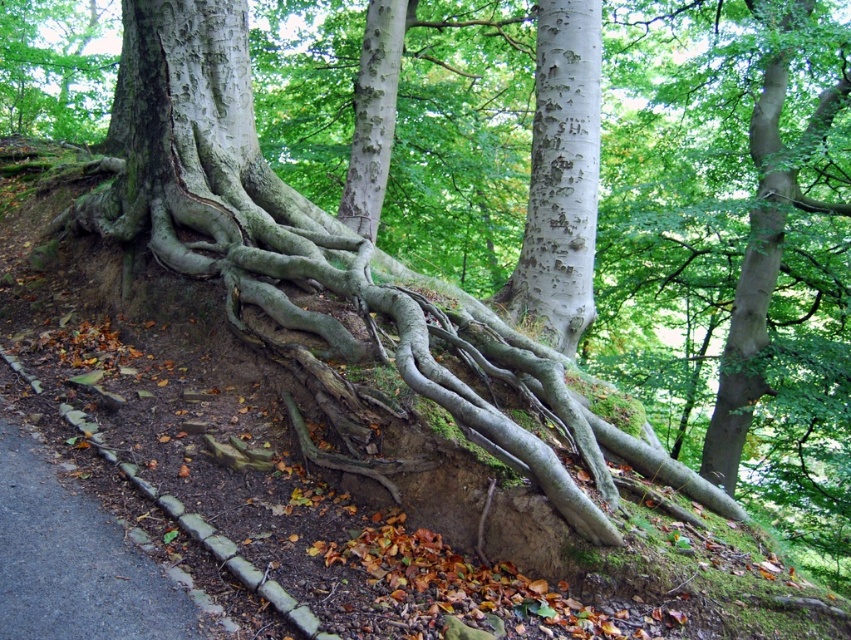
Who is lower down, white speckled bark at center or brown stone curb at lower left?

Positioned lower is brown stone curb at lower left.

Based on the photo, can you confirm if white speckled bark at center is wider than brown stone curb at lower left?

No, white speckled bark at center is not wider than brown stone curb at lower left.

This screenshot has height=640, width=851. What are the coordinates of `white speckled bark at center` in the screenshot? It's located at (560, 180).

Locate an element on the screen. white speckled bark at center is located at coordinates tap(560, 180).

Who is shorter, smooth gray roots at upper left or smooth white bark at center?

smooth gray roots at upper left is shorter.

Can you confirm if smooth gray roots at upper left is positioned to the left of smooth white bark at center?

Indeed, smooth gray roots at upper left is positioned on the left side of smooth white bark at center.

Identify the location of smooth gray roots at upper left. click(x=55, y=68).

Image resolution: width=851 pixels, height=640 pixels. I want to click on smooth gray roots at upper left, so click(x=55, y=68).

Can you confirm if smooth gray roots at upper left is positioned to the left of brown stone curb at lower left?

Correct, you'll find smooth gray roots at upper left to the left of brown stone curb at lower left.

Which is behind, point (23, 84) or point (307, 621)?

The point (23, 84) is more distant.

Between point (10, 115) and point (198, 515), which one is positioned in front?

Point (198, 515)

This screenshot has width=851, height=640. What are the coordinates of `smooth gray roots at upper left` in the screenshot? It's located at (55, 68).